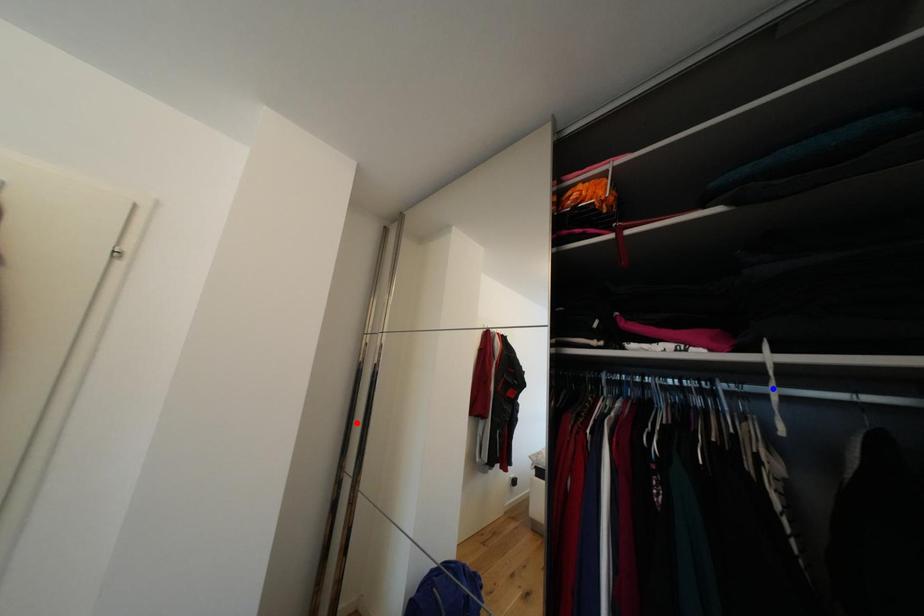
Question: In the image, two points are highlighted. Which point is nearer to the camera? Reply with the corresponding letter.

Choices:
 (A) blue point
 (B) red point

Answer: (A)